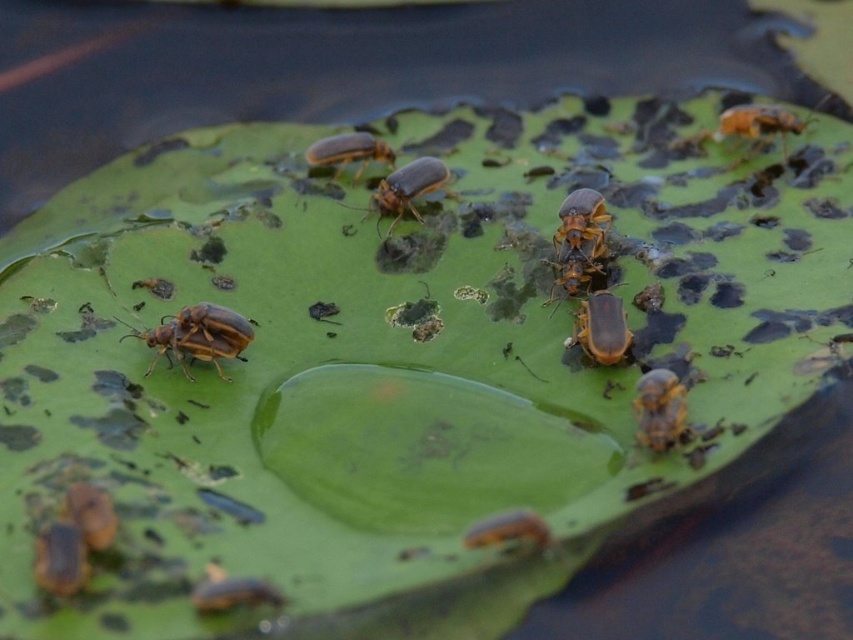
You are a small frog that can jump 10 inches. You are currently on the orange matte beetle at center and want to reach the matte yellow beetle at center. Can you jump directly to it?

The orange matte beetle at center is 10.82 inches from the matte yellow beetle at center. Since the frog can only jump 10 inches, it cannot reach the matte yellow beetle at center in a single jump.

You are a curious child observing the lily pad and its insects. You notice two beetles, the brown matte beetle at center and the orange matte beetle at upper right. Which beetle do you think is larger?

The brown matte beetle at center is bigger than the orange matte beetle at upper right, so the brown matte beetle at center is larger.